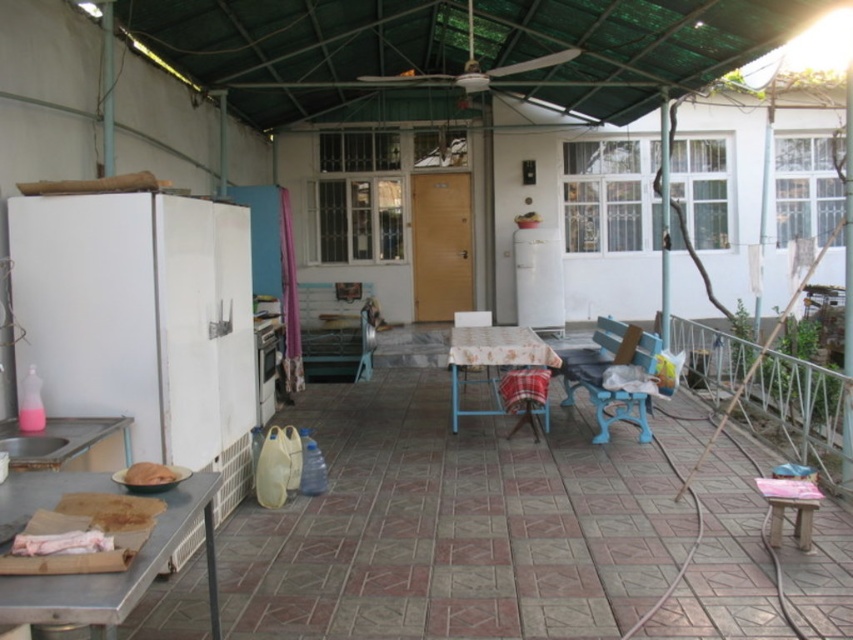
Question: Which object is farther from the camera taking this photo?

Choices:
 (A) blue plastic chair at center
 (B) floral fabric chair at center

Answer: (B)

Question: Does white matte refrigerator at center appear on the left side of satin silver oven at center?

Choices:
 (A) no
 (B) yes

Answer: (A)

Question: Does metallic silver table at lower left appear over floral fabric chair at center?

Choices:
 (A) no
 (B) yes

Answer: (A)

Question: Among these points, which one is nearest to the camera?

Choices:
 (A) (473, 326)
 (B) (567, 371)
 (C) (415, 102)

Answer: (B)

Question: Does green fabric canopy at upper center have a greater width compared to metallic silver table at lower left?

Choices:
 (A) yes
 (B) no

Answer: (B)

Question: Which is nearer to the floral fabric-covered table at center?

Choices:
 (A) blue plastic chair at center
 (B) metallic silver table at lower left
 (C) satin silver oven at center

Answer: (A)